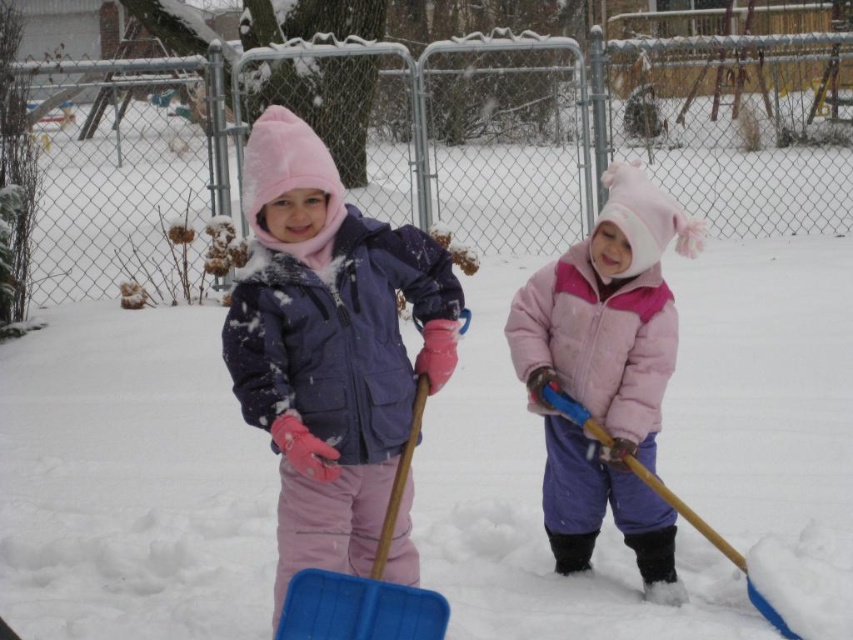
You are a parent trying to decide which item to pack for your child based on size. You have the pink fuzzy winter coat at center and the blue plastic shovel at lower center. Which item requires more space in your bag?

The pink fuzzy winter coat at center requires more space in your bag since it is larger in size than the blue plastic shovel at lower center.